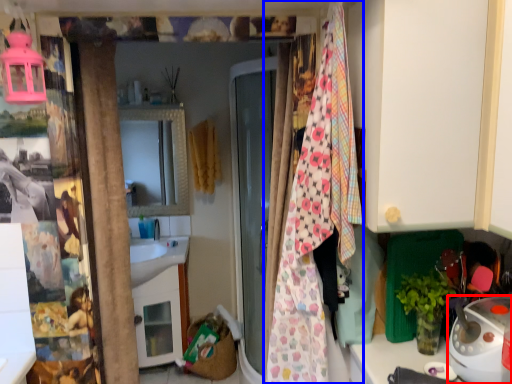
Question: Which of the following is the farthest to the observer, appliance (highlighted by a red box) or blanket (highlighted by a blue box)?

Choices:
 (A) appliance
 (B) blanket

Answer: (A)